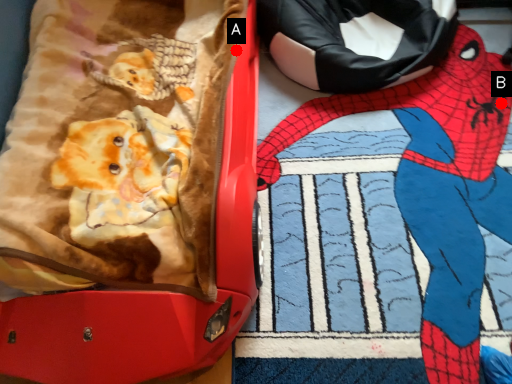
Question: Two points are circled on the image, labeled by A and B beside each circle. Which of the following is the closest to the observer?

Choices:
 (A) A is closer
 (B) B is closer

Answer: (A)